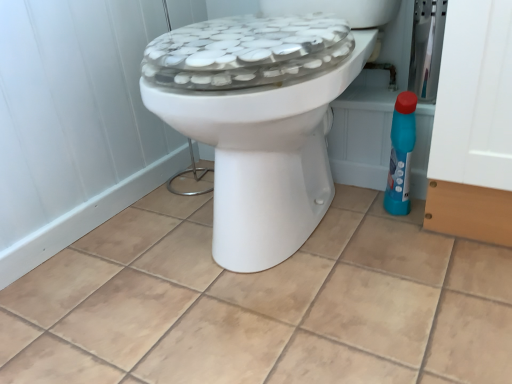
What are the coordinates of `vacant area that is in front of blue plastic bottle at right` in the screenshot? It's located at (416, 242).